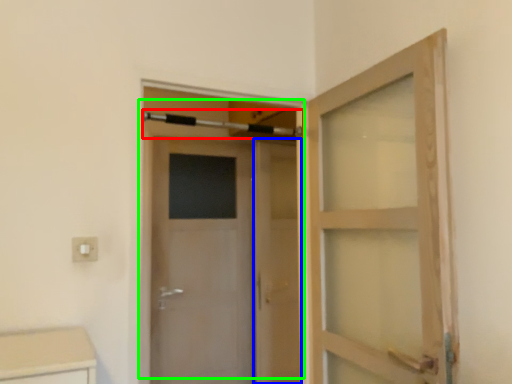
Question: Considering the real-world distances, which object is farthest from towel bar (highlighted by a red box)? screen door (highlighted by a blue box) or door (highlighted by a green box)?

Choices:
 (A) screen door
 (B) door

Answer: (A)